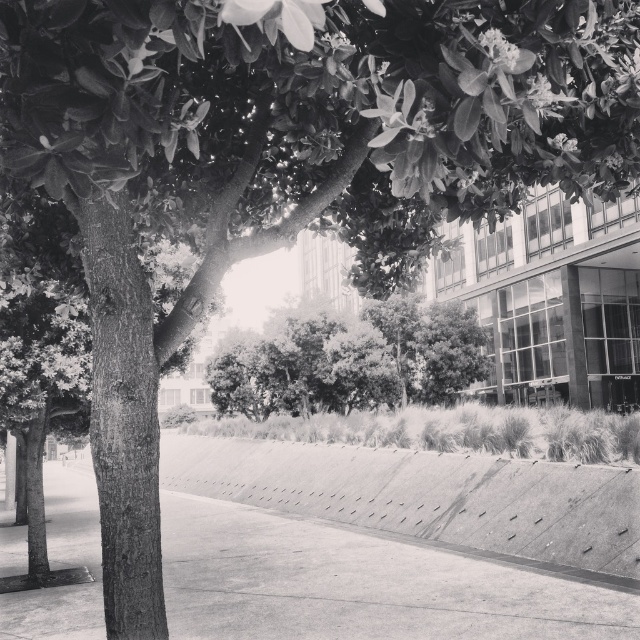
Question: Which of the following is the farthest from the observer?

Choices:
 (A) green leafy tree at center
 (B) smooth concrete pavement at center

Answer: (A)

Question: Among these points, which one is nearest to the camera?

Choices:
 (A) (476, 337)
 (B) (273, 518)

Answer: (B)

Question: Does smooth concrete pavement at center have a smaller size compared to green leafy tree at center?

Choices:
 (A) yes
 (B) no

Answer: (A)

Question: Can you confirm if smooth concrete pavement at center is thinner than green leafy tree at center?

Choices:
 (A) no
 (B) yes

Answer: (B)

Question: Which point appears closest to the camera in this image?

Choices:
 (A) (316, 349)
 (B) (499, 616)

Answer: (B)

Question: Does smooth concrete pavement at center have a larger size compared to green leafy tree at center?

Choices:
 (A) no
 (B) yes

Answer: (A)